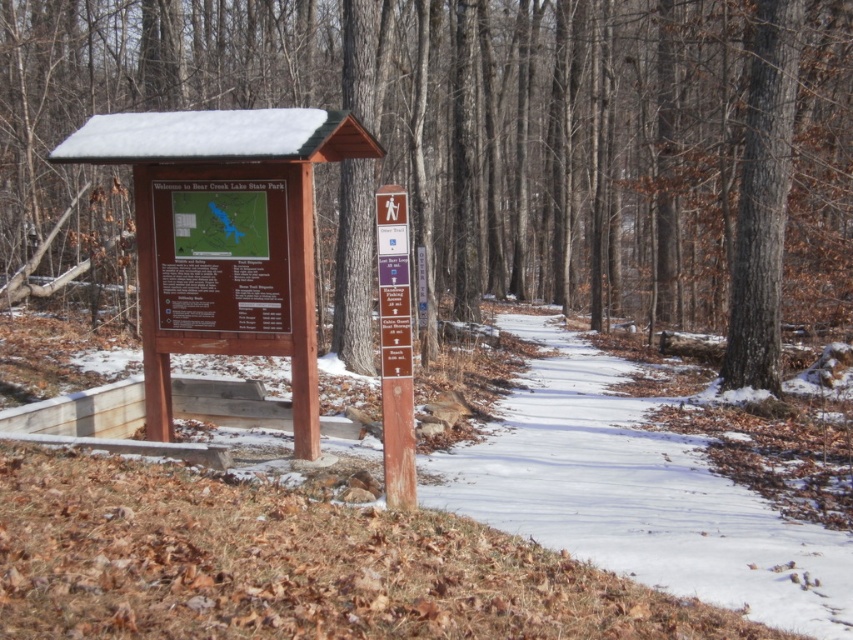
From the picture: You are a hiker with a 5 meter long rope. You want to secure your gear between the brown wood tree at center and the snowy dirt path at center. Is your rope long enough to stretch between them?

The distance between the brown wood tree at center and the snowy dirt path at center is 8.16 meters. Since your rope is only 5 meters long, it is not long enough to stretch between them.

You are a hiker standing at the entrance of Bear Creek Lake State Park. You see a snowy dirt path at center and a wooden signpost at center. Which object is closer to you?

The snowy dirt path at center is closer to you because it is in front of the wooden signpost at center.

You are planning to walk along the snowy dirt path at center in Bear Creek Lake State Park. If you start walking towards the direction indicated by the trail signs, which direction should you face relative to the brown wood tree at center?

Since the brown wood tree at center is positioned on the left side of the snowy dirt path at center, you should face towards the right side of the tree to follow the path in the direction indicated by the trail signs.